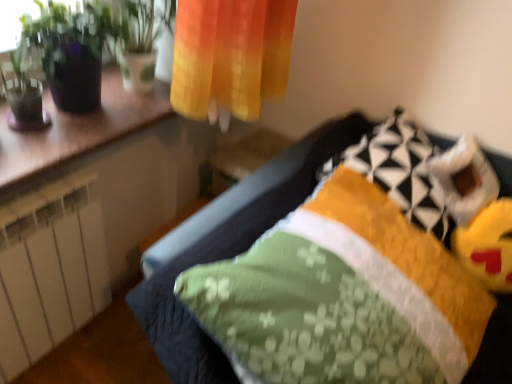
Locate an element on the screen. vacant area on top of wooden counter at upper left (from a real-world perspective) is located at coordinates (69, 120).